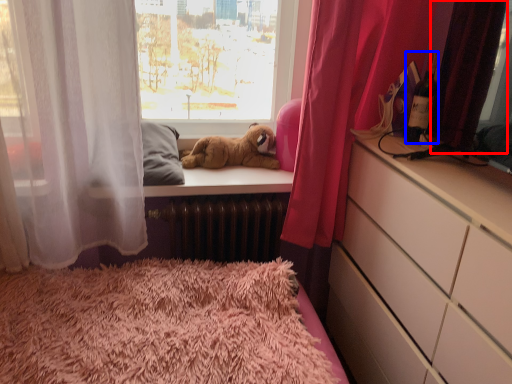
Question: Among these objects, which one is farthest to the camera, curtain (highlighted by a red box) or bottle (highlighted by a blue box)?

Choices:
 (A) curtain
 (B) bottle

Answer: (B)